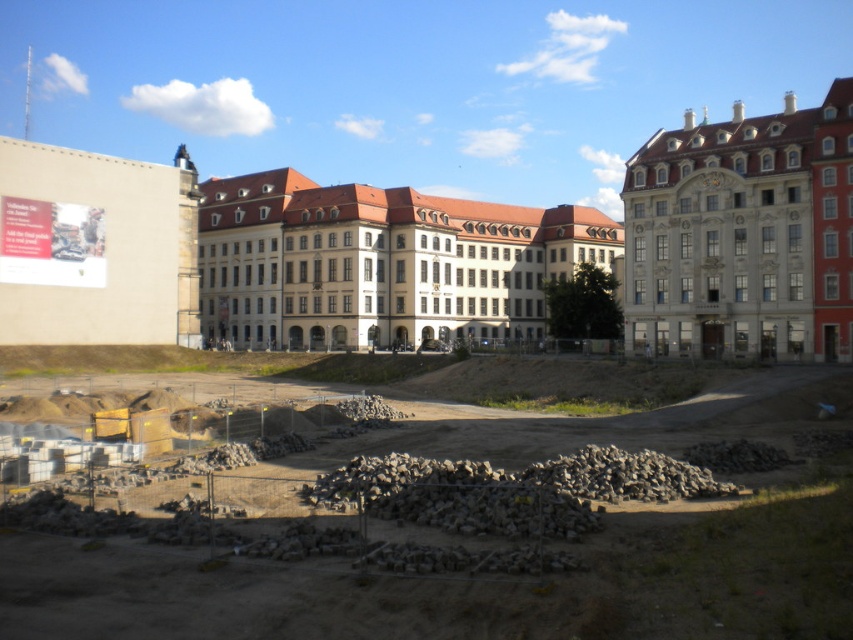
You are a construction worker standing at the edge of the construction site. You need to locate the gray gravel pile at center. Based on the coordinate given, where would you find it in the image?

The gray gravel pile at center is located at the coordinate point 0.911 on the x axis and 0.543 on the y axis in the image.

You are a drone operator tasked with capturing aerial footage of the construction site. Your drone is currently at a position where the camera is pointing towards the beige wall with the poster. You need to fly the drone to a point at coordinates point (849, 538) to get a better shot. Given that the drone can only travel 40 meters in a straight line from its current position, will it be able to reach the point without exceeding its range?

The distance between point (849, 538) and the camera is 38.60 meters. Since the drone can travel up to 40 meters, it will be able to reach the point without exceeding its range.